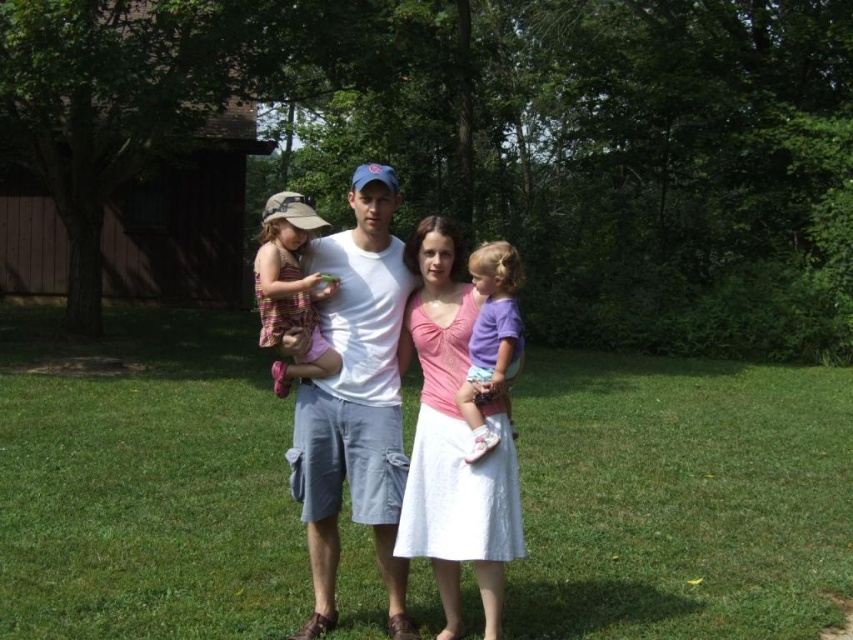
Question: Which of the following is the farthest from the observer?

Choices:
 (A) (397, 545)
 (B) (503, 282)
 (C) (387, 602)

Answer: (C)

Question: Is white cotton t-shirt at center smaller than pink lace dress at center?

Choices:
 (A) yes
 (B) no

Answer: (B)

Question: Estimate the real-world distances between objects in this image. Which object is closer to the pink lace dress at center?

Choices:
 (A) green grass at center
 (B) striped fabric dress at left

Answer: (B)

Question: Is striped fabric dress at left positioned in front of purple cotton shirt at center?

Choices:
 (A) no
 (B) yes

Answer: (A)

Question: Does white cotton t-shirt at center come behind striped fabric dress at left?

Choices:
 (A) no
 (B) yes

Answer: (A)

Question: Among these objects, which one is farthest from the camera?

Choices:
 (A) white cotton t-shirt at center
 (B) green grass at center
 (C) purple cotton shirt at center

Answer: (B)